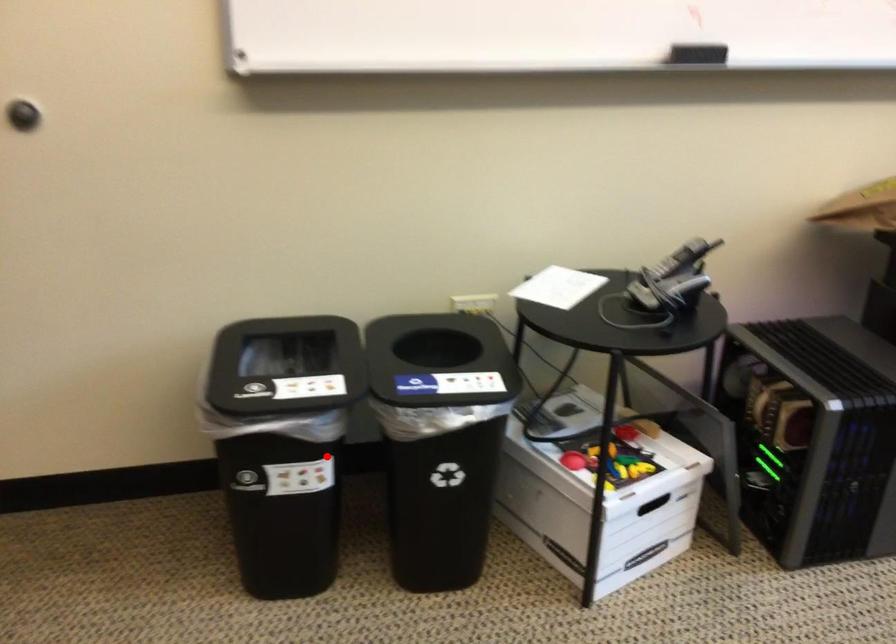
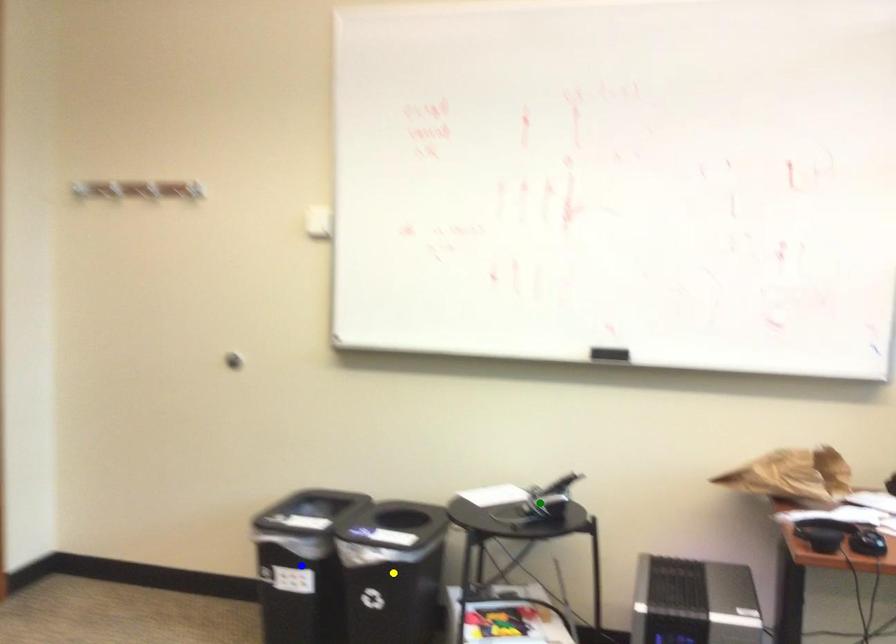
Question: I am providing you with two images of the same scene from different viewpoints. A red point is marked on the first image. You are given multiple points on the second image. Which point in image 2 represents the same 3d spot as the red point in image 1?

Choices:
 (A) blue point
 (B) green point
 (C) yellow point

Answer: (A)